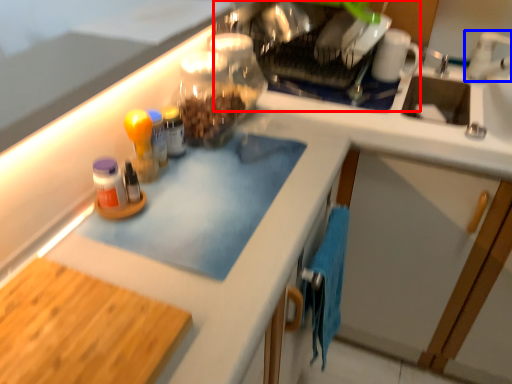
Question: Among these objects, which one is farthest to the camera, appliance (highlighted by a red box) or faucet (highlighted by a blue box)?

Choices:
 (A) appliance
 (B) faucet

Answer: (A)